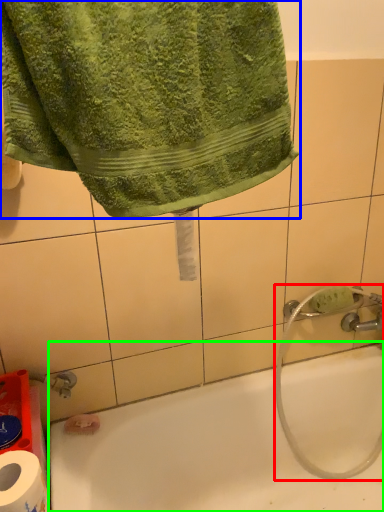
Question: Considering the real-world distances, which object is closest to garden hose (highlighted by a red box)? towel (highlighted by a blue box) or bathtub (highlighted by a green box).

Choices:
 (A) towel
 (B) bathtub

Answer: (B)